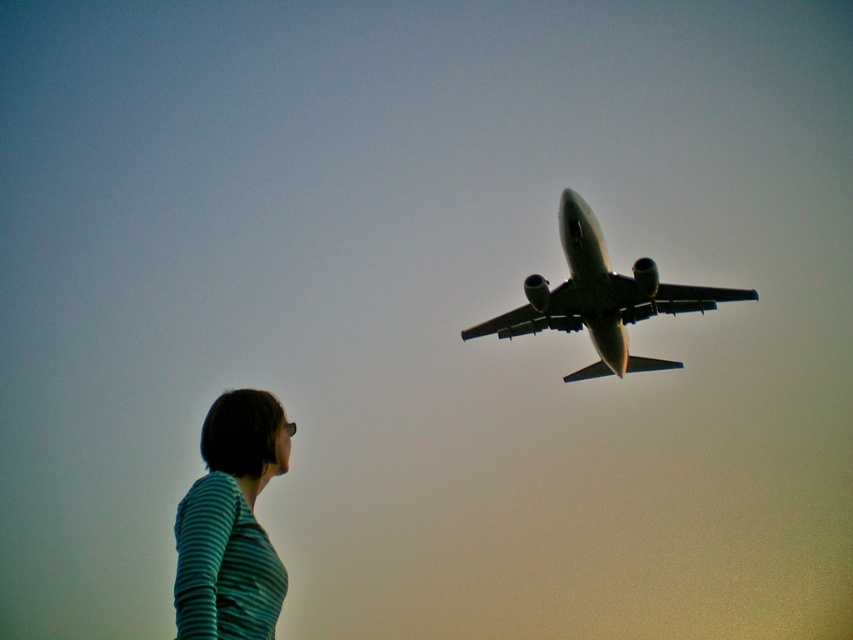
You are an observer looking at the image. Where is the teal striped shirt at lower left located in terms of coordinates?

The teal striped shirt at lower left is located at coordinates point [231,524].

You are standing in the same position as the person in the image. The teal striped shirt at lower left and metallic gray airplane at upper center are in your field of view. Which object is positioned to the left when viewed from your perspective?

The teal striped shirt at lower left is positioned to the left of the metallic gray airplane at upper center from your perspective.